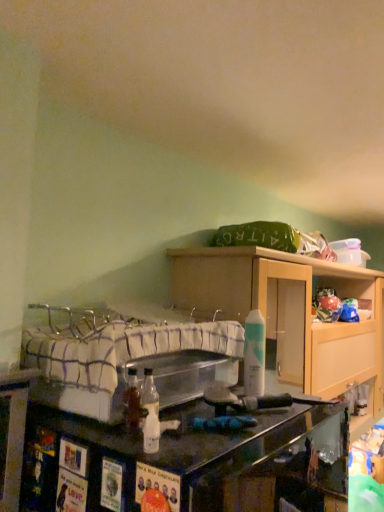
Question: Considering their positions, is matte wood cabinet at upper center located in front of or behind white matte spray can at center?

Choices:
 (A) behind
 (B) front

Answer: (A)

Question: Looking at their shapes, would you say matte wood cabinet at upper center is wider or thinner than white matte spray can at center?

Choices:
 (A) wide
 (B) thin

Answer: (A)

Question: Based on their relative distances, which object is farther from the matte wood cabinet at upper center?

Choices:
 (A) plaid fabric bed at center
 (B) white matte spray can at center

Answer: (B)

Question: Based on their relative distances, which object is farther from the matte wood cabinet at upper center?

Choices:
 (A) plaid fabric bed at center
 (B) white matte spray can at center

Answer: (B)